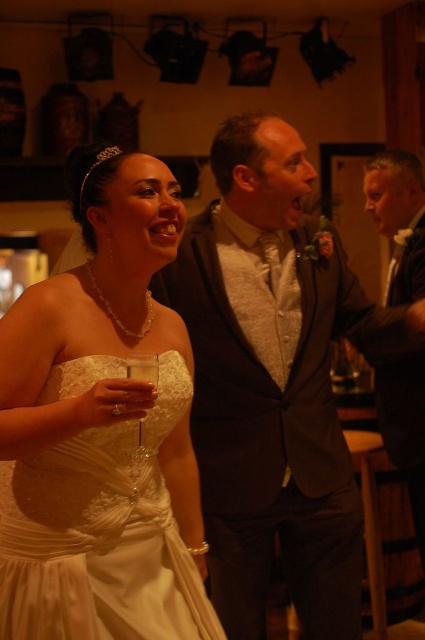
Which is above, white satin dress at left or clear glass wine glass at lower left?

Positioned higher is white satin dress at left.

Which is more to the left, white satin dress at left or clear glass wine glass at lower left?

From the viewer's perspective, white satin dress at left appears more on the left side.

What do you see at coordinates (102, 429) in the screenshot? I see `white satin dress at left` at bounding box center [102, 429].

At what (x,y) coordinates should I click in order to perform the action: click on white satin dress at left. Please return your answer as a coordinate pair (x, y). Looking at the image, I should click on point(102,429).

Is shiny silver vest at center thinner than clear glass wine glass at lower left?

No.

Can you confirm if shiny silver vest at center is positioned above clear glass wine glass at lower left?

Indeed, shiny silver vest at center is positioned over clear glass wine glass at lower left.

This screenshot has height=640, width=425. I want to click on shiny silver vest at center, so click(274, 381).

This screenshot has height=640, width=425. Identify the location of shiny silver vest at center. (274, 381).

This screenshot has height=640, width=425. What do you see at coordinates (102, 429) in the screenshot?
I see `white satin dress at left` at bounding box center [102, 429].

Does white satin dress at left have a smaller size compared to shiny silver vest at center?

Yes, white satin dress at left is smaller than shiny silver vest at center.

Where is `white satin dress at left`? Image resolution: width=425 pixels, height=640 pixels. white satin dress at left is located at coordinates (102, 429).